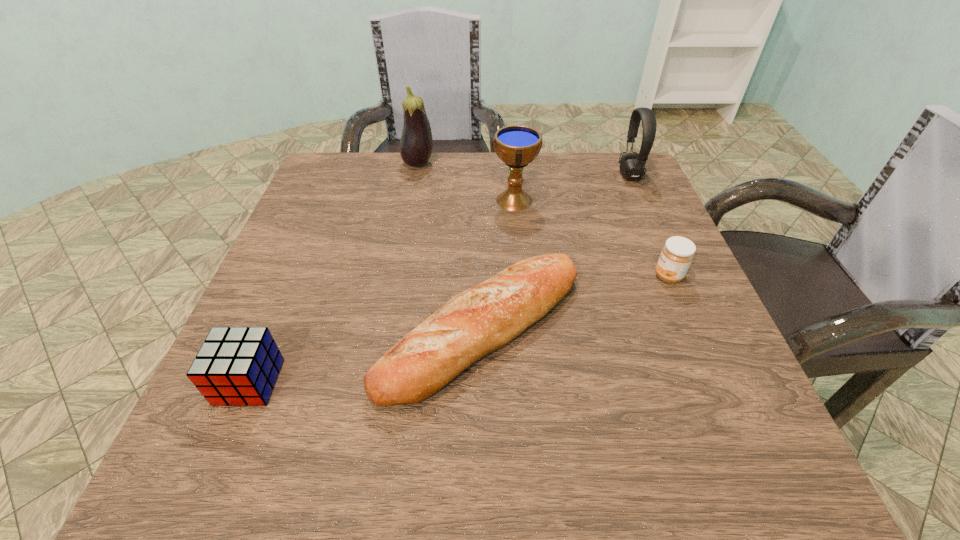
Find the location of `free space that satisfies the following two spatial constraints: 1. on the back side of the chalice; 2. on the right side of the cube`. free space that satisfies the following two spatial constraints: 1. on the back side of the chalice; 2. on the right side of the cube is located at coordinates (326, 200).